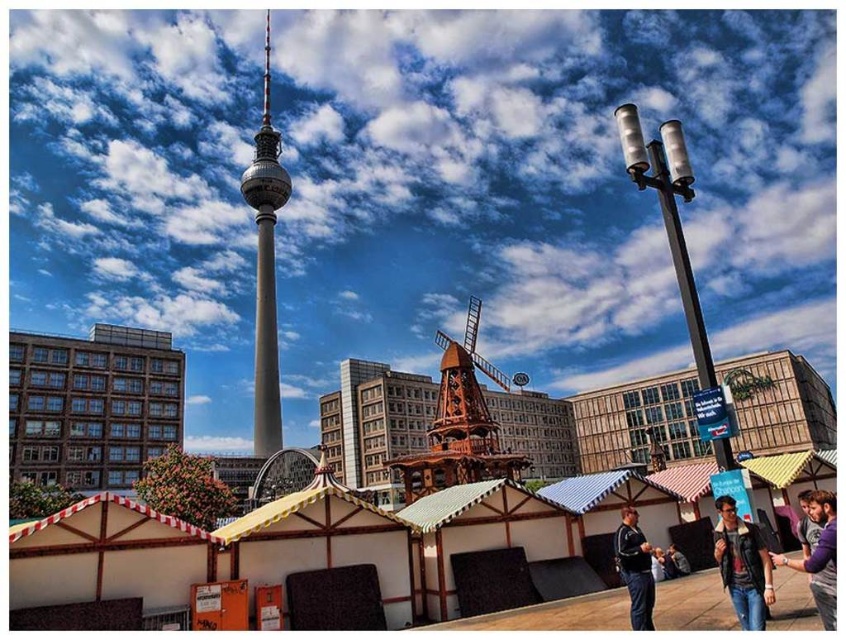
Between smooth gray tower at center and dark blue shirt at lower right, which one is positioned lower?

Positioned lower is dark blue shirt at lower right.

Is smooth gray tower at center above dark blue shirt at lower right?

Correct, smooth gray tower at center is located above dark blue shirt at lower right.

Does point (265, 433) come closer to viewer compared to point (633, 604)?

That is False.

Locate an element on the screen. This screenshot has width=846, height=640. smooth gray tower at center is located at coordinates (265, 266).

Who is taller, leather jacket at lower right or dark blue shirt at lower right?

With more height is dark blue shirt at lower right.

Is point (735, 520) closer to camera compared to point (624, 561)?

Yes, it is.

Identify the location of leather jacket at lower right. The height and width of the screenshot is (640, 846). 742,564.

Looking at this image, is metallic silver streetlight at upper right below beige fabric jacket at lower right?

No, metallic silver streetlight at upper right is not below beige fabric jacket at lower right.

Does point (663, 212) come behind point (817, 612)?

Yes, it is behind point (817, 612).

Is point (718, 467) in front of point (827, 500)?

No, it is behind (827, 500).

I want to click on metallic silver streetlight at upper right, so click(668, 212).